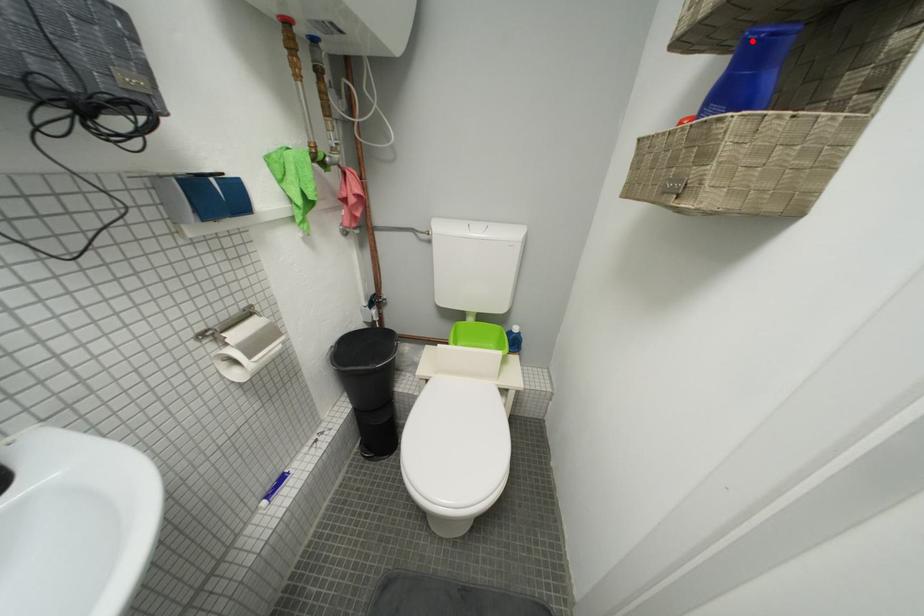
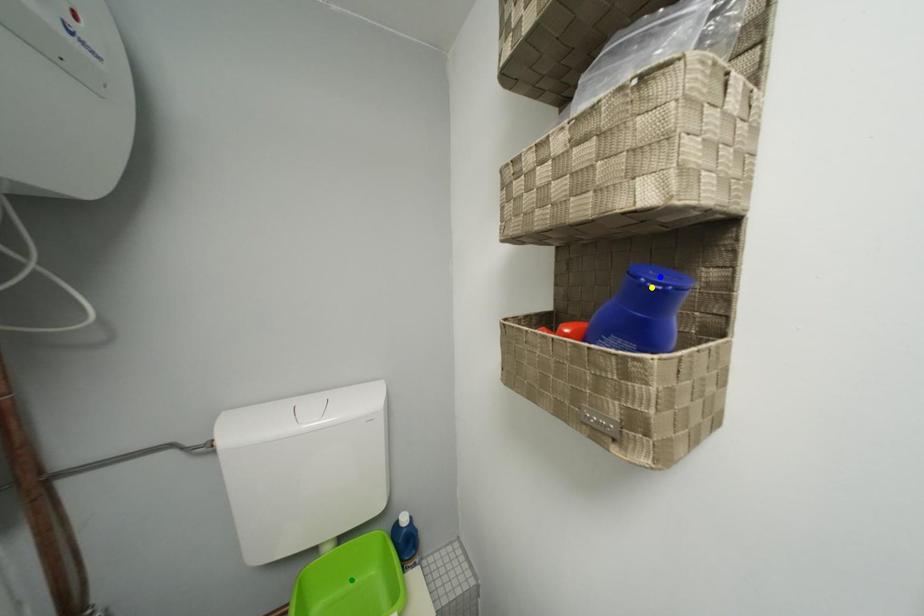
Question: I am providing you with two images of the same scene from different viewpoints. A red point is marked on the first image. You are given multiple points on the second image. In image 2, which mark is for the same physical point as the one in image 1?

Choices:
 (A) blue point
 (B) green point
 (C) yellow point

Answer: (C)